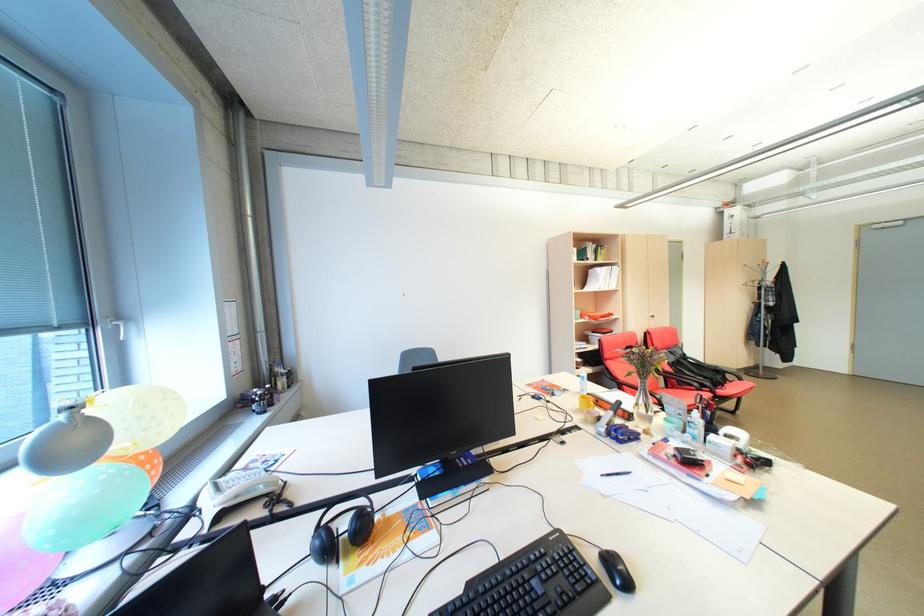
Which object does [606,419] point to?

This point indicates the white glue stick.